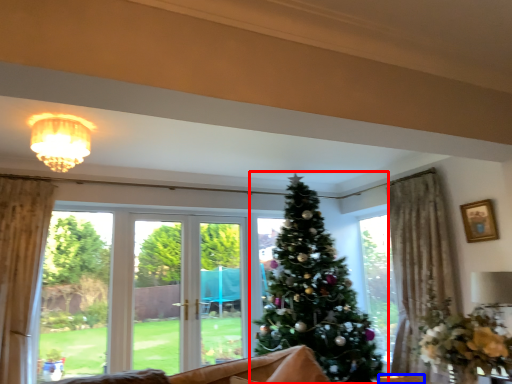
Question: Among these objects, which one is farthest to the camera, christmas tree (highlighted by a red box) or furniture (highlighted by a blue box)?

Choices:
 (A) christmas tree
 (B) furniture

Answer: (A)